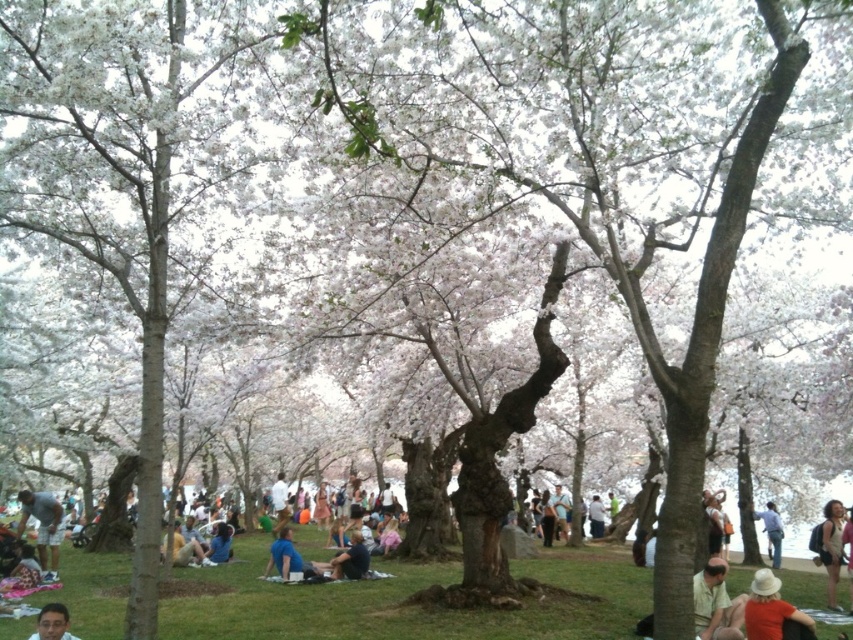
Who is positioned more to the left, light brown fabric hat at lower right or blue fabric at center?

From the viewer's perspective, blue fabric at center appears more on the left side.

Is point (734, 620) farther from viewer compared to point (280, 529)?

No, it is not.

You are a GUI agent. You are given a task and a screenshot of the screen. Output one action in this format:
    pyautogui.click(x=<x>, y=<y>)
    Task: Click on the light brown fabric hat at lower right
    The height and width of the screenshot is (640, 853).
    Given the screenshot: What is the action you would take?
    pyautogui.click(x=715, y=604)

Between dark brown backpack at lower right and blue jeans at lower right, which one has less height?

dark brown backpack at lower right

Between dark brown backpack at lower right and blue jeans at lower right, which one has more height?

Standing taller between the two is blue jeans at lower right.

Describe the element at coordinates (833, 547) in the screenshot. I see `dark brown backpack at lower right` at that location.

I want to click on dark brown backpack at lower right, so [833, 547].

How distant is matte orange shirt at lower right from light blue denim shorts at lower left?

A distance of 45.29 meters exists between matte orange shirt at lower right and light blue denim shorts at lower left.

Is matte orange shirt at lower right below light blue denim shorts at lower left?

Incorrect, matte orange shirt at lower right is not positioned below light blue denim shorts at lower left.

This screenshot has height=640, width=853. I want to click on matte orange shirt at lower right, so click(770, 609).